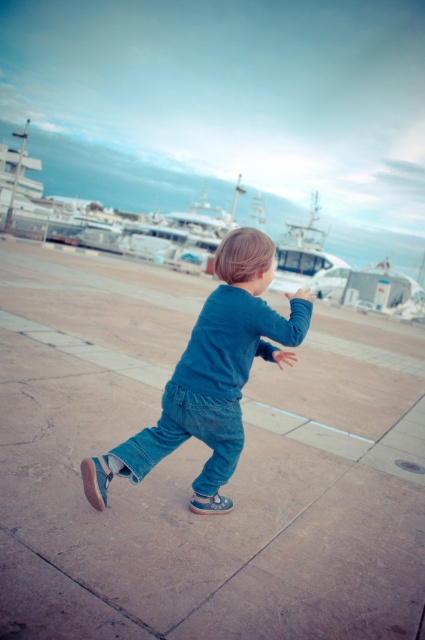
Does brown stone pavement at center have a greater width compared to denim pants at center?

Indeed, brown stone pavement at center has a greater width compared to denim pants at center.

Who is shorter, brown stone pavement at center or denim pants at center?

With less height is denim pants at center.

Between point (36, 536) and point (203, 330), which one is positioned behind?

Point (203, 330)

At what (x,y) coordinates should I click in order to perform the action: click on brown stone pavement at center. Please return your answer as a coordinate pair (x, y). This screenshot has width=425, height=640. Looking at the image, I should click on (200, 468).

Can you confirm if denim pants at center is shorter than white glossy boat at center?

Yes.

Describe the element at coordinates (212, 376) in the screenshot. This screenshot has height=640, width=425. I see `denim pants at center` at that location.

The image size is (425, 640). What are the coordinates of `denim pants at center` in the screenshot? It's located at (212, 376).

At what (x,y) coordinates should I click in order to perform the action: click on brown stone pavement at center. Please return your answer as a coordinate pair (x, y). Looking at the image, I should click on 200,468.

Can you confirm if brown stone pavement at center is smaller than white glossy boat at center?

Yes, brown stone pavement at center is smaller than white glossy boat at center.

Between point (42, 522) and point (275, 289), which one is positioned in front?

Positioned in front is point (42, 522).

Locate an element on the screen. This screenshot has height=640, width=425. brown stone pavement at center is located at coordinates (200, 468).